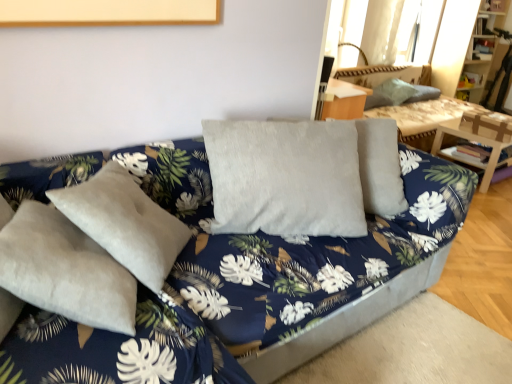
Question: Is velvet gray pillows at upper right to the left of translucent fabric curtain at upper right from the viewer's perspective?

Choices:
 (A) yes
 (B) no

Answer: (A)

Question: Can you confirm if velvet gray pillows at upper right is wider than translucent fabric curtain at upper right?

Choices:
 (A) no
 (B) yes

Answer: (B)

Question: From a real-world perspective, does velvet gray pillows at upper right stand above translucent fabric curtain at upper right?

Choices:
 (A) yes
 (B) no

Answer: (B)

Question: Can you confirm if velvet gray pillows at upper right is positioned to the right of translucent fabric curtain at upper right?

Choices:
 (A) no
 (B) yes

Answer: (A)

Question: Is there a large distance between velvet gray pillows at upper right and translucent fabric curtain at upper right?

Choices:
 (A) no
 (B) yes

Answer: (A)

Question: From a real-world perspective, relative to velvet gray pillows at upper right, is wooden table at right vertically above or below?

Choices:
 (A) below
 (B) above

Answer: (A)

Question: Based on their positions, is wooden table at right located to the left or right of velvet gray pillows at upper right?

Choices:
 (A) right
 (B) left

Answer: (A)

Question: Considering the positions of wooden table at right and velvet gray pillows at upper right in the image, is wooden table at right bigger or smaller than velvet gray pillows at upper right?

Choices:
 (A) small
 (B) big

Answer: (A)

Question: Is wooden table at right taller or shorter than velvet gray pillows at upper right?

Choices:
 (A) tall
 (B) short

Answer: (B)

Question: Do you think velvet gray couch at center is within wooden table at right, or outside of it?

Choices:
 (A) inside
 (B) outside

Answer: (B)

Question: Considering the positions of point (151, 322) and point (449, 122), is point (151, 322) closer or farther from the camera than point (449, 122)?

Choices:
 (A) farther
 (B) closer

Answer: (B)

Question: Considering the positions of velvet gray couch at center and wooden table at right in the image, is velvet gray couch at center bigger or smaller than wooden table at right?

Choices:
 (A) small
 (B) big

Answer: (B)

Question: In the image, is velvet gray couch at center positioned in front of or behind wooden table at right?

Choices:
 (A) behind
 (B) front

Answer: (B)

Question: Is wooden table at right wider or thinner than wooden bookshelf at upper right?

Choices:
 (A) thin
 (B) wide

Answer: (B)

Question: In terms of size, does wooden table at right appear bigger or smaller than wooden bookshelf at upper right?

Choices:
 (A) small
 (B) big

Answer: (A)